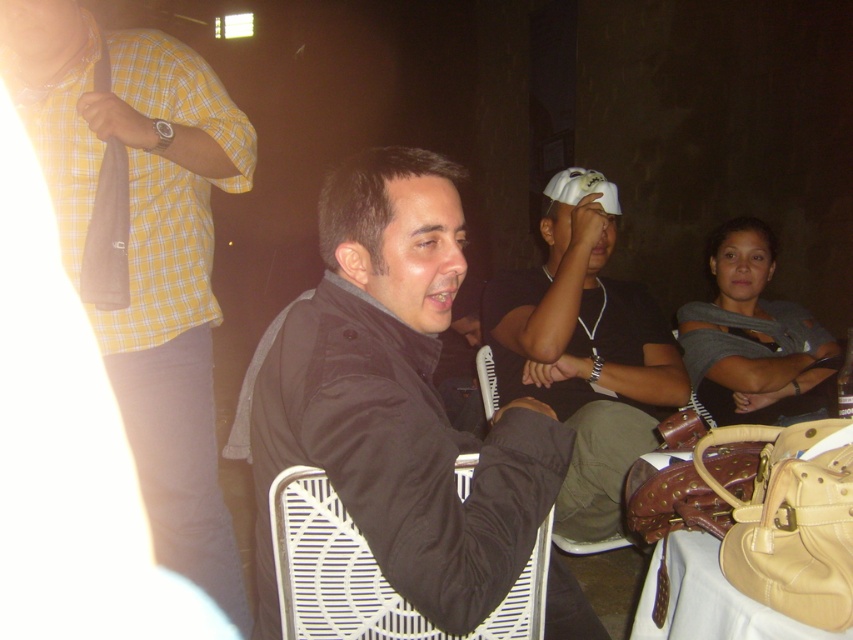
You are standing at the entrance of the event and see the white plastic chair at center and the beige leather table at lower right. Which object is closer to the left side of the frame?

The white plastic chair at center is closer to the left side of the frame because it is positioned to the left of the beige leather table at lower right.

You are standing in the same room as the man in the image. You want to walk from your current position to the point marked by the coordinates point (554, 332). However, there is an obstacle located at point (770, 394). Will you be able to reach your destination without going around the obstacle?

Since point (554, 332) is in front of point (770, 394), you can reach the destination without needing to go around the obstacle as the path is clear.

You are at an indoor gathering and see two shirts hanging on a coat rack. The yellow checkered shirt at upper left and the gray fabric shirt at upper right. Which shirt is taller?

The yellow checkered shirt at upper left is much taller than the gray fabric shirt at upper right.